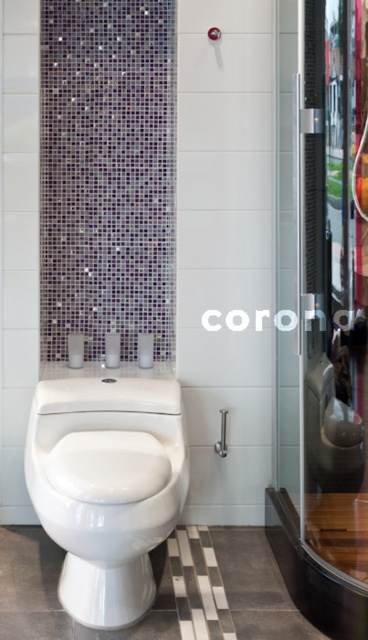
Which is behind, point (351, 307) or point (79, 410)?

Positioned behind is point (351, 307).

Is transparent glass shower door at right positioned behind white glossy toilet at lower left?

Yes, transparent glass shower door at right is behind white glossy toilet at lower left.

Is point (292, 376) positioned behind point (50, 435)?

Yes, it is.

Locate an element on the screen. This screenshot has width=368, height=640. transparent glass shower door at right is located at coordinates (324, 276).

Is point (86, 477) positioned behind point (221, 428)?

No.

Does point (83, 493) lie in front of point (228, 410)?

Yes, it is.

The width and height of the screenshot is (368, 640). What do you see at coordinates (107, 486) in the screenshot?
I see `white glossy toilet at lower left` at bounding box center [107, 486].

Image resolution: width=368 pixels, height=640 pixels. I want to click on white glossy toilet at lower left, so click(x=107, y=486).

How far apart are transparent glass shower door at right and satin nickel shower handle at upper center?

transparent glass shower door at right and satin nickel shower handle at upper center are 31.48 inches apart from each other.

Describe the element at coordinates (324, 276) in the screenshot. I see `transparent glass shower door at right` at that location.

Which is behind, point (341, 192) or point (224, 444)?

Positioned behind is point (224, 444).

Where is `transparent glass shower door at right`? The height and width of the screenshot is (640, 368). transparent glass shower door at right is located at coordinates (324, 276).